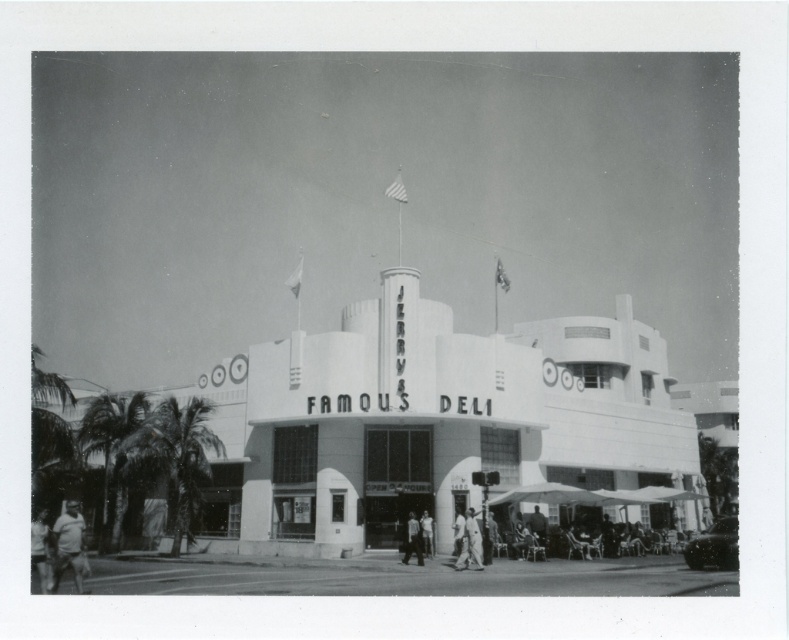
What are the coordinates of the white cotton shirt at center?

The white cotton shirt at center is located at coordinates point (x=470, y=544).

From the picture: You are a photographer trying to capture a clear shot of the FAMOUS DELI sign. You notice two subjects in the frame, a white cotton shirt at center and a smooth skin person at center. Which subject should you ask to move so that the FAMOUS DELI sign is fully visible?

You should ask the white cotton shirt at center to move because it is larger than the smooth skin person at center and is blocking the view of the FAMOUS DELI sign.